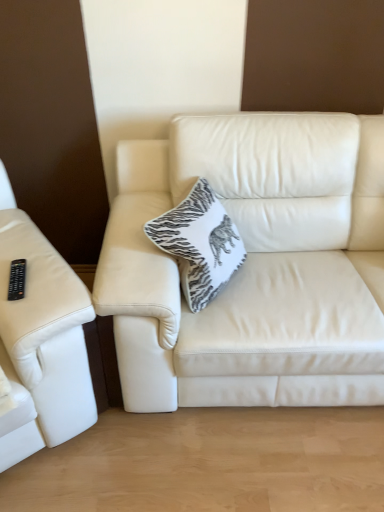
Question: In which direction should I rotate to look at white leather couch at center, the 1th studio couch from the right?

Choices:
 (A) right
 (B) left

Answer: (A)

Question: From the image's perspective, would you say black plastic remote at left is positioned over white leather couch at center, the second studio couch when ordered from left to right?

Choices:
 (A) no
 (B) yes

Answer: (A)

Question: Does black plastic remote at left have a smaller size compared to white leather couch at center, the 1th studio couch from the right?

Choices:
 (A) no
 (B) yes

Answer: (B)

Question: Does black plastic remote at left have a greater height compared to white leather couch at center, the 1th studio couch from the right?

Choices:
 (A) yes
 (B) no

Answer: (B)

Question: Can you confirm if black plastic remote at left is thinner than white leather couch at center, the second studio couch when ordered from left to right?

Choices:
 (A) yes
 (B) no

Answer: (A)

Question: Is black plastic remote at left next to white leather couch at center, the second studio couch when ordered from left to right, and touching it?

Choices:
 (A) yes
 (B) no

Answer: (B)

Question: Is black plastic remote at left not close to white leather couch at center, the second studio couch when ordered from left to right?

Choices:
 (A) no
 (B) yes

Answer: (A)

Question: Is white leather couch at center, the second studio couch when ordered from left to right, thinner than leather couch at left, which is the second studio couch from right to left?

Choices:
 (A) no
 (B) yes

Answer: (B)

Question: From a real-world perspective, is white leather couch at center, the second studio couch when ordered from left to right, located beneath leather couch at left, arranged as the first studio couch when viewed from the left?

Choices:
 (A) no
 (B) yes

Answer: (B)

Question: From the image's perspective, is white leather couch at center, the 1th studio couch from the right, located beneath leather couch at left, arranged as the first studio couch when viewed from the left?

Choices:
 (A) yes
 (B) no

Answer: (B)

Question: Considering the relative sizes of white leather couch at center, the 1th studio couch from the right, and leather couch at left, arranged as the first studio couch when viewed from the left, in the image provided, is white leather couch at center, the 1th studio couch from the right, wider than leather couch at left, arranged as the first studio couch when viewed from the left,?

Choices:
 (A) yes
 (B) no

Answer: (B)

Question: Does white leather couch at center, the 1th studio couch from the right, have a larger size compared to leather couch at left, arranged as the first studio couch when viewed from the left?

Choices:
 (A) no
 (B) yes

Answer: (B)

Question: Can you confirm if white leather couch at center, the 1th studio couch from the right, is smaller than leather couch at left, which is the second studio couch from right to left?

Choices:
 (A) yes
 (B) no

Answer: (B)

Question: Is white leather couch at center, the second studio couch when ordered from left to right, oriented away from black plastic remote at left?

Choices:
 (A) no
 (B) yes

Answer: (A)